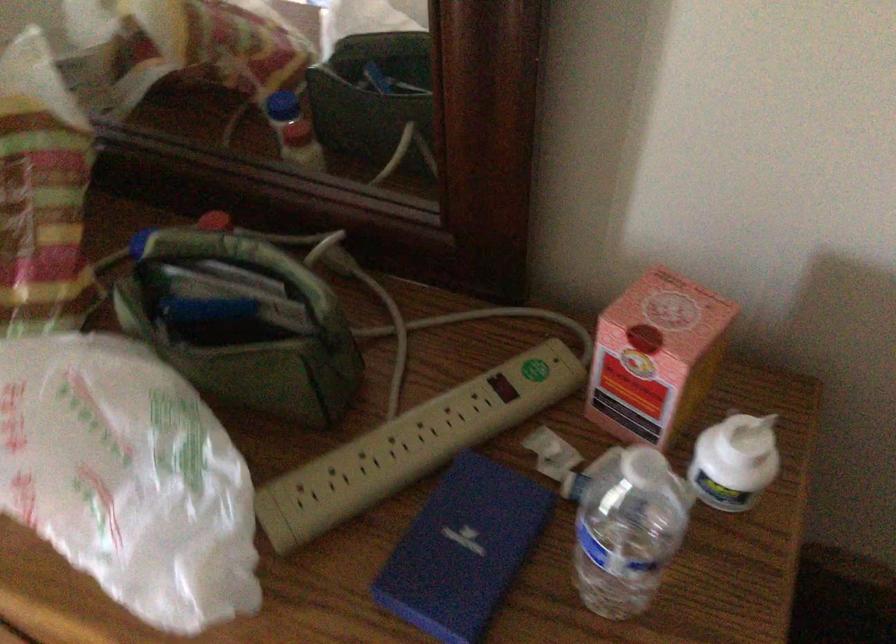
Find where to lift the green fabric pouch. Please return your answer as a coordinate pair (x, y).

(239, 322)